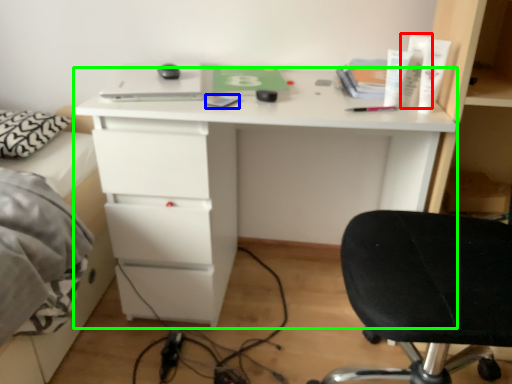
Question: Which is farther away from toiletry (highlighted by a red box)? notepad (highlighted by a blue box) or desk (highlighted by a green box)?

Choices:
 (A) notepad
 (B) desk

Answer: (B)